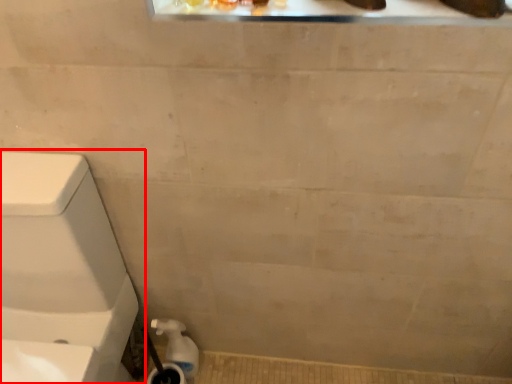
Question: Observing the image, what is the correct spatial positioning of toilet (annotated by the red box) in reference to water pipe?

Choices:
 (A) left
 (B) right

Answer: (A)